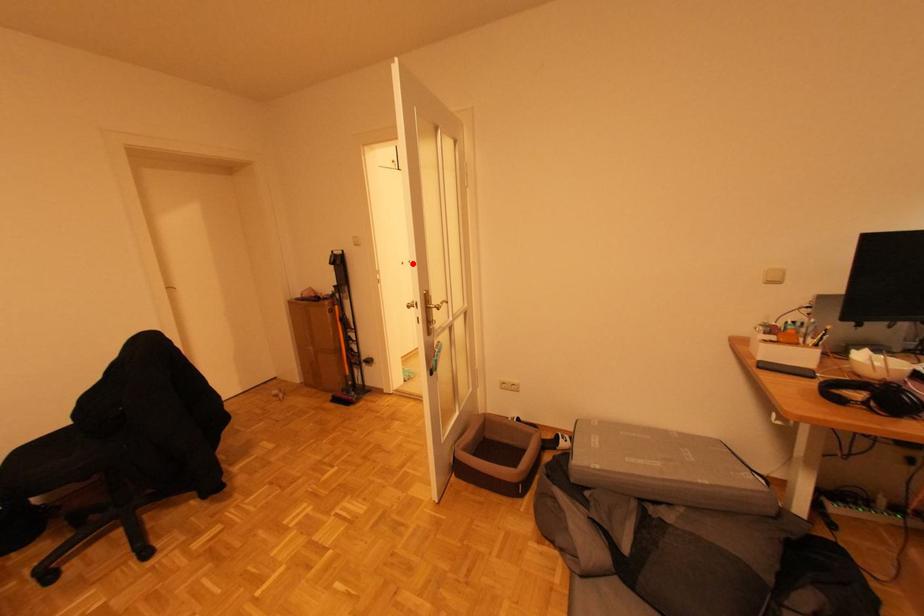
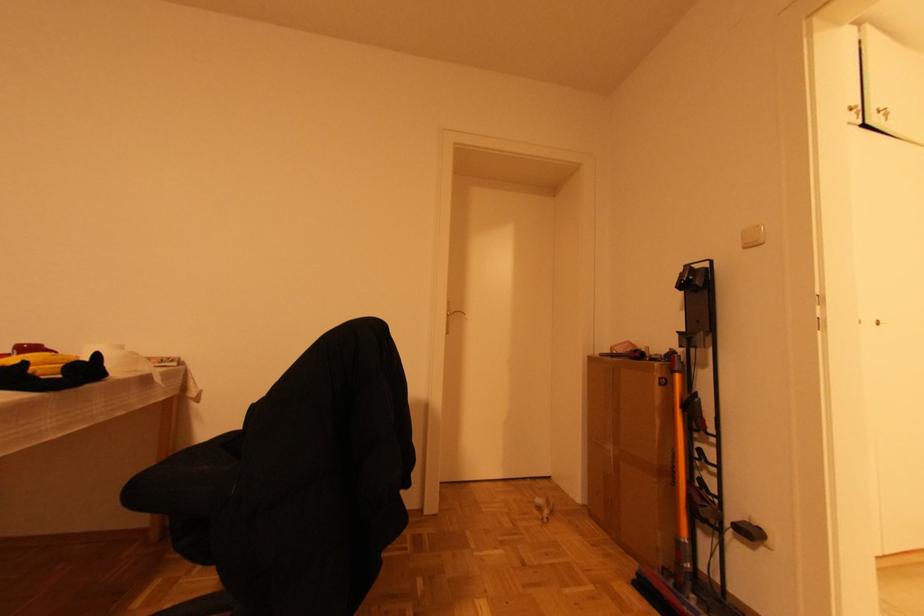
Locate, in the second image, the point that corresponds to the highlighted location in the first image.

(881, 325)